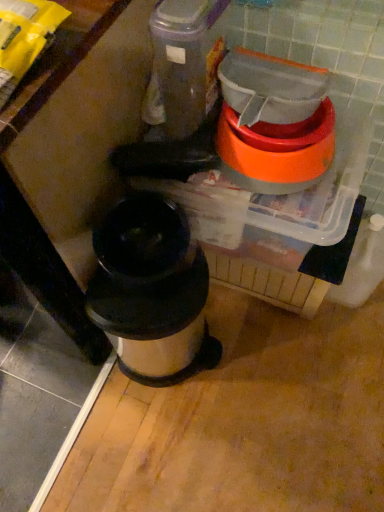
Question: Can you confirm if stainless steel trash can at center is smaller than orange plastic bowl at upper right?

Choices:
 (A) yes
 (B) no

Answer: (B)

Question: Is stainless steel trash can at center far from orange plastic bowl at upper right?

Choices:
 (A) yes
 (B) no

Answer: (B)

Question: Is stainless steel trash can at center located outside orange plastic bowl at upper right?

Choices:
 (A) yes
 (B) no

Answer: (A)

Question: From a real-world perspective, is stainless steel trash can at center located beneath orange plastic bowl at upper right?

Choices:
 (A) no
 (B) yes

Answer: (B)

Question: Is stainless steel trash can at center surrounding orange plastic bowl at upper right?

Choices:
 (A) no
 (B) yes

Answer: (A)

Question: Can you confirm if stainless steel trash can at center is bigger than orange plastic bowl at upper right?

Choices:
 (A) yes
 (B) no

Answer: (A)

Question: Is orange plastic bowl at upper right looking in the opposite direction of stainless steel trash can at center?

Choices:
 (A) no
 (B) yes

Answer: (A)

Question: Is orange plastic bowl at upper right facing towards stainless steel trash can at center?

Choices:
 (A) no
 (B) yes

Answer: (A)

Question: Is orange plastic bowl at upper right far away from stainless steel trash can at center?

Choices:
 (A) yes
 (B) no

Answer: (B)

Question: Is orange plastic bowl at upper right to the left of stainless steel trash can at center from the viewer's perspective?

Choices:
 (A) yes
 (B) no

Answer: (B)

Question: Can you confirm if orange plastic bowl at upper right is shorter than stainless steel trash can at center?

Choices:
 (A) yes
 (B) no

Answer: (A)

Question: From the image's perspective, does orange plastic bowl at upper right appear lower than stainless steel trash can at center?

Choices:
 (A) yes
 (B) no

Answer: (B)

Question: In terms of height, does stainless steel trash can at center look taller or shorter compared to orange plastic bowl at upper right?

Choices:
 (A) short
 (B) tall

Answer: (B)